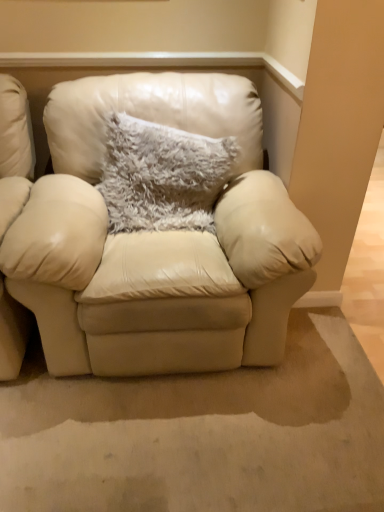
Question: Is fuzzy gray pillow at center aimed at matte cream leather armchair at center?

Choices:
 (A) yes
 (B) no

Answer: (A)

Question: From a real-world perspective, is fuzzy gray pillow at center positioned under matte cream leather armchair at center based on gravity?

Choices:
 (A) yes
 (B) no

Answer: (B)

Question: Does fuzzy gray pillow at center have a greater height compared to matte cream leather armchair at center?

Choices:
 (A) yes
 (B) no

Answer: (B)

Question: Is fuzzy gray pillow at center bigger than matte cream leather armchair at center?

Choices:
 (A) yes
 (B) no

Answer: (B)

Question: From the image's perspective, is fuzzy gray pillow at center above matte cream leather armchair at center?

Choices:
 (A) no
 (B) yes

Answer: (B)

Question: Considering their positions, is fuzzy gray pillow at center located in front of or behind beige leather chair at left?

Choices:
 (A) behind
 (B) front

Answer: (A)

Question: Looking at their shapes, would you say fuzzy gray pillow at center is wider or thinner than beige leather chair at left?

Choices:
 (A) wide
 (B) thin

Answer: (B)

Question: Is fuzzy gray pillow at center inside the boundaries of beige leather chair at left, or outside?

Choices:
 (A) outside
 (B) inside

Answer: (A)

Question: Does point tap(125, 158) appear closer or farther from the camera than point tap(1, 373)?

Choices:
 (A) closer
 (B) farther

Answer: (B)

Question: Does point (61, 305) appear closer or farther from the camera than point (155, 152)?

Choices:
 (A) closer
 (B) farther

Answer: (A)

Question: From the image's perspective, relative to fuzzy gray pillow at center, is matte cream leather armchair at center above or below?

Choices:
 (A) above
 (B) below

Answer: (B)

Question: Considering the positions of matte cream leather armchair at center and fuzzy gray pillow at center in the image, is matte cream leather armchair at center bigger or smaller than fuzzy gray pillow at center?

Choices:
 (A) small
 (B) big

Answer: (B)

Question: Is matte cream leather armchair at center inside the boundaries of fuzzy gray pillow at center, or outside?

Choices:
 (A) outside
 (B) inside

Answer: (A)

Question: Considering the positions of point (8, 214) and point (140, 224), is point (8, 214) closer or farther from the camera than point (140, 224)?

Choices:
 (A) farther
 (B) closer

Answer: (B)

Question: In terms of size, does beige leather chair at left appear bigger or smaller than fuzzy gray pillow at center?

Choices:
 (A) big
 (B) small

Answer: (A)